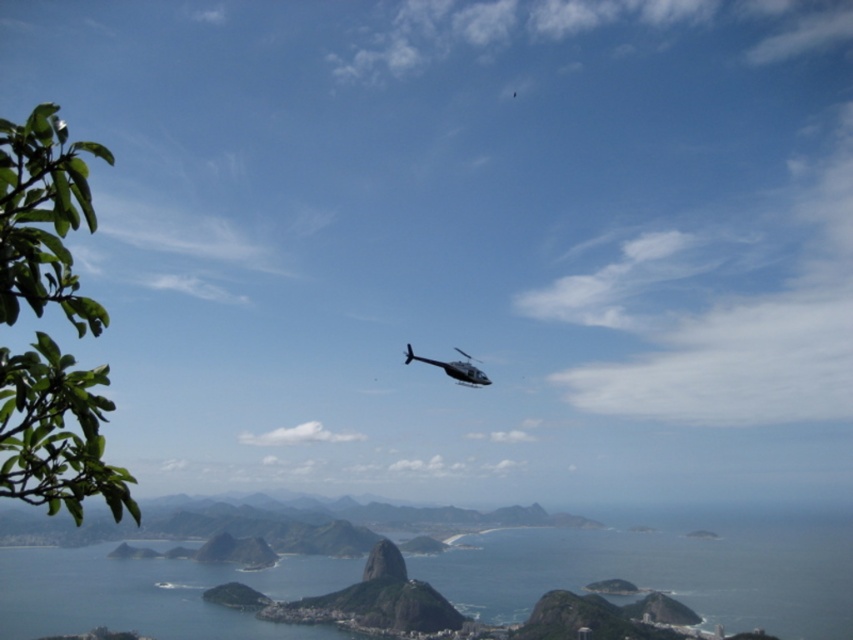
Question: Can you confirm if blue water at center is positioned to the left of metallic silver helicopter at center?

Choices:
 (A) yes
 (B) no

Answer: (A)

Question: Is blue water at center below metallic silver helicopter at center?

Choices:
 (A) yes
 (B) no

Answer: (A)

Question: Among these objects, which one is farthest from the camera?

Choices:
 (A) blue water at center
 (B) metallic silver helicopter at center

Answer: (A)

Question: Is blue water at center positioned at the back of metallic silver helicopter at center?

Choices:
 (A) yes
 (B) no

Answer: (A)

Question: Which point is farther to the camera?

Choices:
 (A) (440, 362)
 (B) (692, 582)

Answer: (B)